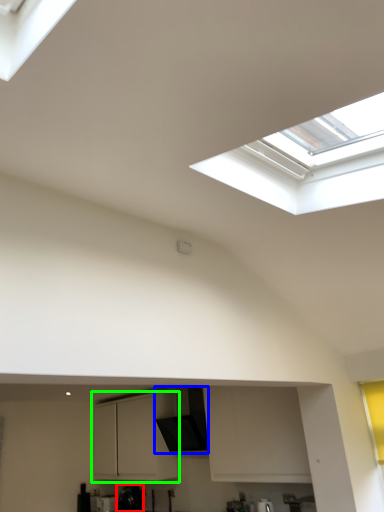
Question: Considering the real-world distances, which object is farthest from appliance (highlighted by a red box)? exhaust hood (highlighted by a blue box) or cabinetry (highlighted by a green box)?

Choices:
 (A) exhaust hood
 (B) cabinetry

Answer: (A)